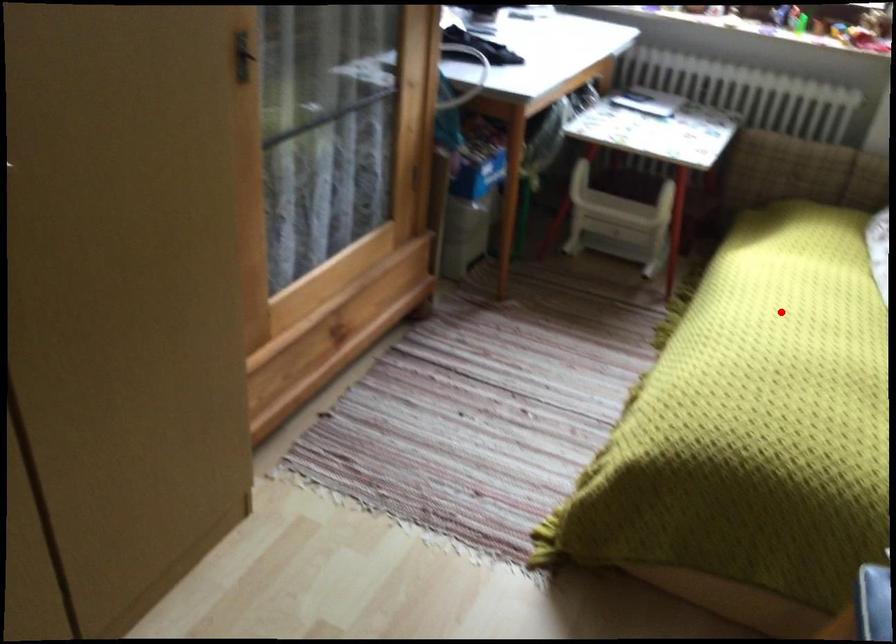
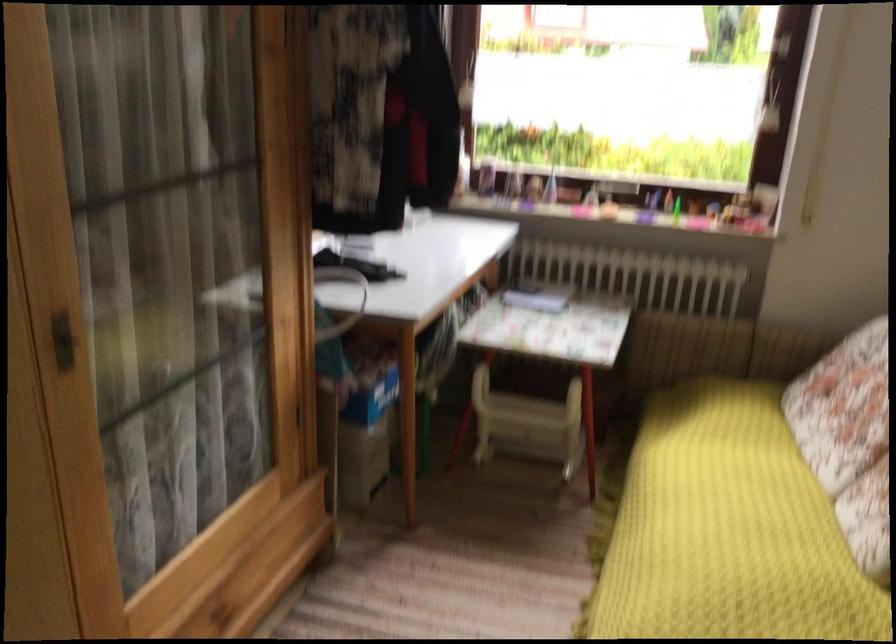
Question: I am providing you with two images of the same scene from different viewpoints. A red point is marked on the first image. Can you still see the location of the red point in image 2?

Choices:
 (A) Yes
 (B) No

Answer: (A)